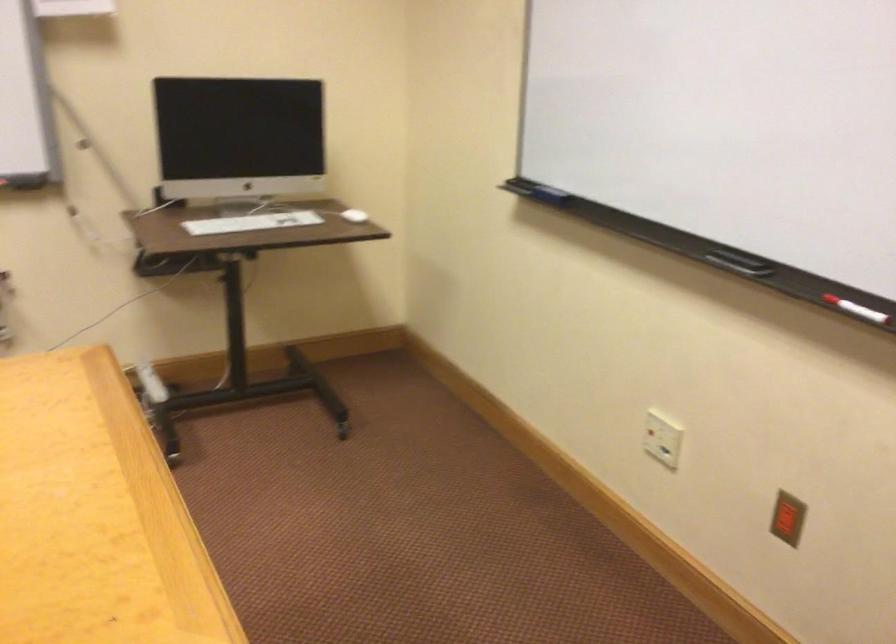
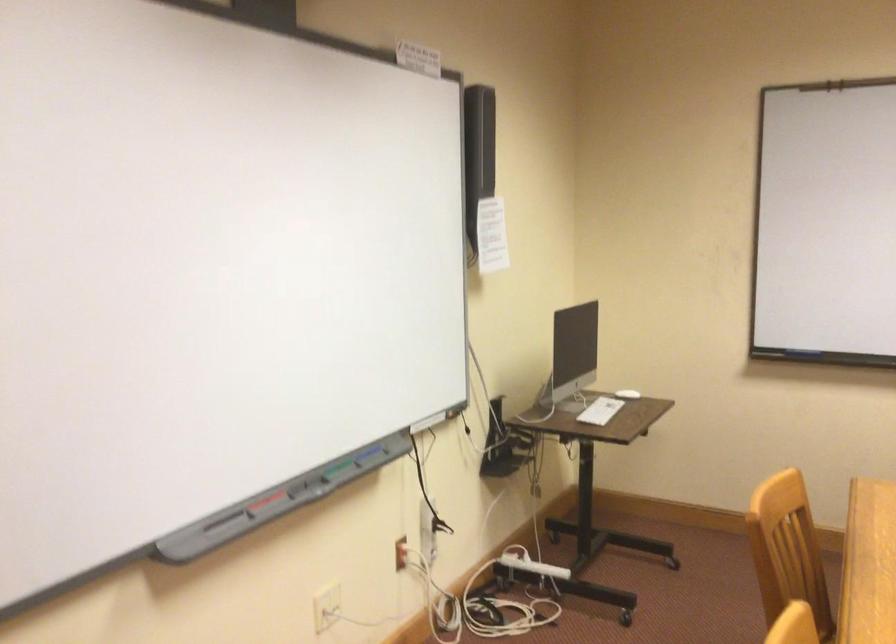
Locate, in the second image, the point that corresponds to (234,222) in the first image.

(600, 410)